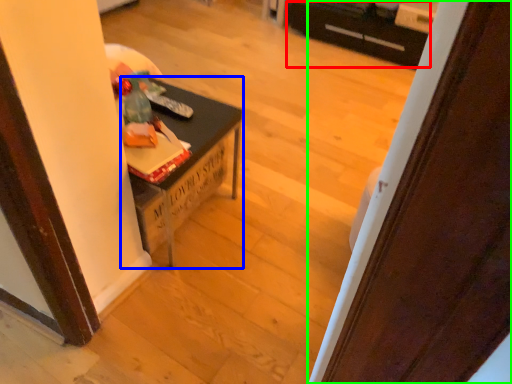
Question: Which is farther away from drawer (highlighted by a red box)? table (highlighted by a blue box) or door (highlighted by a green box)?

Choices:
 (A) table
 (B) door

Answer: (B)